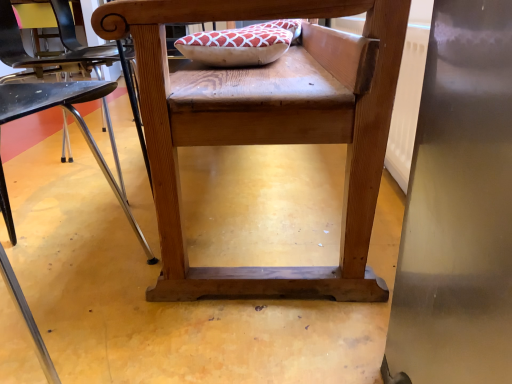
Question: Can you confirm if wooden chair at center, the 2th chair in the right-to-left sequence, is shorter than wooden chair at center, arranged as the 2th chair when viewed from the left?

Choices:
 (A) no
 (B) yes

Answer: (B)

Question: Is there a large distance between wooden chair at center, the 2th chair in the right-to-left sequence, and wooden chair at center, the 1th chair viewed from the right?

Choices:
 (A) no
 (B) yes

Answer: (A)

Question: Is wooden chair at center, the 2th chair in the right-to-left sequence, in contact with wooden chair at center, the 1th chair viewed from the right?

Choices:
 (A) no
 (B) yes

Answer: (A)

Question: From a real-world perspective, is wooden chair at center, the 2th chair in the right-to-left sequence, over wooden chair at center, the 1th chair viewed from the right?

Choices:
 (A) no
 (B) yes

Answer: (A)

Question: Does wooden chair at center, which ranks as the first chair in left-to-right order, have a greater height compared to wooden chair at center, the 1th chair viewed from the right?

Choices:
 (A) yes
 (B) no

Answer: (B)

Question: Is wooden chair at center, which ranks as the first chair in left-to-right order, oriented away from wooden chair at center, arranged as the 2th chair when viewed from the left?

Choices:
 (A) yes
 (B) no

Answer: (B)

Question: Is wooden chair at center, arranged as the 2th chair when viewed from the left, wider than wooden chair at center, which ranks as the first chair in left-to-right order?

Choices:
 (A) no
 (B) yes

Answer: (B)

Question: Considering the relative sizes of wooden chair at center, arranged as the 2th chair when viewed from the left, and wooden chair at center, the 2th chair in the right-to-left sequence, in the image provided, is wooden chair at center, arranged as the 2th chair when viewed from the left, shorter than wooden chair at center, the 2th chair in the right-to-left sequence,?

Choices:
 (A) no
 (B) yes

Answer: (A)

Question: Is wooden chair at center, the 1th chair viewed from the right, next to wooden chair at center, the 2th chair in the right-to-left sequence, and touching it?

Choices:
 (A) yes
 (B) no

Answer: (B)

Question: Is wooden chair at center, the 1th chair viewed from the right, not inside wooden chair at center, which ranks as the first chair in left-to-right order?

Choices:
 (A) yes
 (B) no

Answer: (A)

Question: Considering the relative positions of wooden chair at center, the 1th chair viewed from the right, and wooden chair at center, which ranks as the first chair in left-to-right order, in the image provided, is wooden chair at center, the 1th chair viewed from the right, in front of wooden chair at center, which ranks as the first chair in left-to-right order,?

Choices:
 (A) no
 (B) yes

Answer: (A)

Question: From the image's perspective, is wooden chair at center, arranged as the 2th chair when viewed from the left, located beneath wooden chair at center, the 2th chair in the right-to-left sequence?

Choices:
 (A) yes
 (B) no

Answer: (B)

Question: In terms of width, does wooden chair at center, arranged as the 2th chair when viewed from the left, look wider or thinner when compared to wooden chair at center, which ranks as the first chair in left-to-right order?

Choices:
 (A) thin
 (B) wide

Answer: (B)